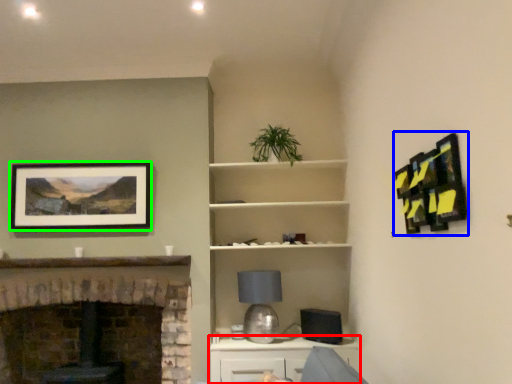
Question: Based on their relative distances, which object is nearer to cabinetry (highlighted by a red box)? Choose from picture frame (highlighted by a blue box) and picture frame (highlighted by a green box).

Choices:
 (A) picture frame
 (B) picture frame

Answer: (B)